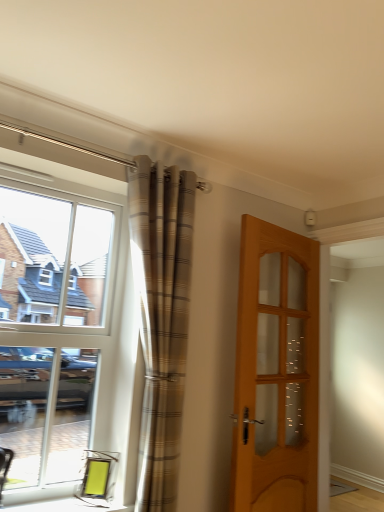
Measure the distance between point (65, 328) and camera.

A distance of 6.52 feet exists between point (65, 328) and camera.

Locate an element on the screen. matte glass window sill at lower left is located at coordinates (69, 506).

Find the location of `wooden glass door at right`. wooden glass door at right is located at coordinates (276, 372).

Based on the photo, is plaid fabric curtain at left at the right side of wooden glass door at right?

No, plaid fabric curtain at left is not to the right of wooden glass door at right.

Which of these two, plaid fabric curtain at left or wooden glass door at right, is thinner?

wooden glass door at right is thinner.

Is plaid fabric curtain at left taller or shorter than wooden glass door at right?

plaid fabric curtain at left is taller than wooden glass door at right.

Which is more to the right, matte glass window sill at lower left or white glass window at left?

From the viewer's perspective, matte glass window sill at lower left appears more on the right side.

Which is behind, point (84, 499) or point (89, 397)?

Positioned behind is point (89, 397).

Does matte glass window sill at lower left turn towards white glass window at left?

No.

Does point (313, 370) lie behind point (95, 346)?

That is True.

Is wooden glass door at right positioned with its back to white glass window at left?

No, wooden glass door at right's orientation is not away from white glass window at left.

Can you confirm if wooden glass door at right is positioned to the right of white glass window at left?

Correct, you'll find wooden glass door at right to the right of white glass window at left.

From a real-world perspective, which is physically above, wooden glass door at right or white glass window at left?

In real-world perspective, white glass window at left is above.

Can you confirm if wooden glass door at right is taller than matte glass window sill at lower left?

Yes, wooden glass door at right is taller than matte glass window sill at lower left.

Does wooden glass door at right come behind matte glass window sill at lower left?

Yes, the depth of wooden glass door at right is greater than that of matte glass window sill at lower left.

Between plaid fabric curtain at left and white glass window at left, which one appears on the right side from the viewer's perspective?

plaid fabric curtain at left is more to the right.

Does point (171, 303) come farther from viewer compared to point (76, 227)?

No, it is not.

Which of these two, plaid fabric curtain at left or white glass window at left, is wider?

plaid fabric curtain at left is wider.

Is plaid fabric curtain at left positioned far away from white glass window at left?

No, plaid fabric curtain at left is not far away from white glass window at left.

Does matte glass window sill at lower left turn towards wooden glass door at right?

No, matte glass window sill at lower left is not aimed at wooden glass door at right.

From a real-world perspective, is matte glass window sill at lower left beneath wooden glass door at right?

Yes, from a real-world perspective, matte glass window sill at lower left is under wooden glass door at right.

Looking at this image, which is more distant, (65, 511) or (280, 277)?

Point (280, 277)

What's the angular difference between matte glass window sill at lower left and wooden glass door at right's facing directions?

The facing directions of matte glass window sill at lower left and wooden glass door at right are 11.8 degrees apart.

From a real-world perspective, is matte glass window sill at lower left positioned over plaid fabric curtain at left based on gravity?

No, from a real-world perspective, matte glass window sill at lower left is not above plaid fabric curtain at left.

Considering the sizes of matte glass window sill at lower left and plaid fabric curtain at left in the image, is matte glass window sill at lower left taller or shorter than plaid fabric curtain at left?

Considering their sizes, matte glass window sill at lower left has less height than plaid fabric curtain at left.

Looking at their sizes, would you say matte glass window sill at lower left is wider or thinner than plaid fabric curtain at left?

Clearly, matte glass window sill at lower left has more width compared to plaid fabric curtain at left.

In order to click on door located below the plaid fabric curtain at left (from the image's perspective) in this screenshot , I will do `click(276, 372)`.

Identify the location of window sill in front of the white glass window at left. The height and width of the screenshot is (512, 384). (69, 506).

Estimate the real-world distances between objects in this image. Which object is closer to white glass window at left, plaid fabric curtain at left or matte glass window sill at lower left?

plaid fabric curtain at left is positioned closer to the anchor white glass window at left.

Looking at the image, which one is located closer to wooden glass door at right, white glass window at left or matte glass window sill at lower left?

white glass window at left lies closer to wooden glass door at right than the other object.

Estimate the real-world distances between objects in this image. Which object is closer to plaid fabric curtain at left, wooden glass door at right or matte glass window sill at lower left?

wooden glass door at right is closer to plaid fabric curtain at left.

Which object lies further to the anchor point plaid fabric curtain at left, matte glass window sill at lower left or white glass window at left?

Based on the image, matte glass window sill at lower left appears to be further to plaid fabric curtain at left.

Looking at the image, which one is located closer to plaid fabric curtain at left, white glass window at left or wooden glass door at right?

Based on the image, white glass window at left appears to be nearer to plaid fabric curtain at left.

Estimate the real-world distances between objects in this image. Which object is further from wooden glass door at right, matte glass window sill at lower left or white glass window at left?

The object further to wooden glass door at right is matte glass window sill at lower left.

Looking at the image, which one is located further to white glass window at left, wooden glass door at right or matte glass window sill at lower left?

Based on the image, wooden glass door at right appears to be further to white glass window at left.

Which object lies further to the anchor point white glass window at left, matte glass window sill at lower left or wooden glass door at right?

The object further to white glass window at left is wooden glass door at right.

Where is `curtain that lies between white glass window at left and matte glass window sill at lower left from top to bottom`? This screenshot has width=384, height=512. curtain that lies between white glass window at left and matte glass window sill at lower left from top to bottom is located at coordinates (161, 318).

The height and width of the screenshot is (512, 384). What are the coordinates of `curtain situated between matte glass window sill at lower left and wooden glass door at right from left to right` in the screenshot? It's located at (161, 318).

The height and width of the screenshot is (512, 384). What are the coordinates of `curtain between white glass window at left and wooden glass door at right in the horizontal direction` in the screenshot? It's located at (161, 318).

At what (x,y) coordinates should I click in order to perform the action: click on window sill located between white glass window at left and wooden glass door at right in the left-right direction. Please return your answer as a coordinate pair (x, y). The image size is (384, 512). Looking at the image, I should click on (69, 506).